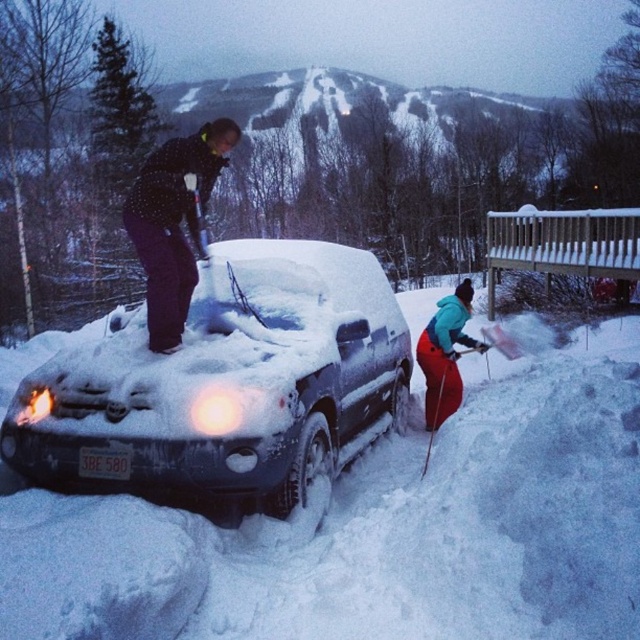
Question: Which point is farther to the camera?

Choices:
 (A) (264, 364)
 (B) (456, 305)

Answer: (B)

Question: Which object is positioned farthest from the snow-covered suv at center?

Choices:
 (A) polka dot fabric jacket at upper left
 (B) teal fabric jacket at center
 (C) white fluffy snow at lower left

Answer: (B)

Question: Can you confirm if white fluffy snow at lower left is bigger than polka dot fabric jacket at upper left?

Choices:
 (A) yes
 (B) no

Answer: (B)

Question: Which point is farther to the camera?

Choices:
 (A) (77, 570)
 (B) (188, 145)

Answer: (B)

Question: Is white fluffy snow at lower left to the left of polka dot fabric jacket at upper left from the viewer's perspective?

Choices:
 (A) yes
 (B) no

Answer: (A)

Question: Considering the relative positions of white fluffy snow at lower left and polka dot fabric jacket at upper left in the image provided, where is white fluffy snow at lower left located with respect to polka dot fabric jacket at upper left?

Choices:
 (A) above
 (B) below

Answer: (B)